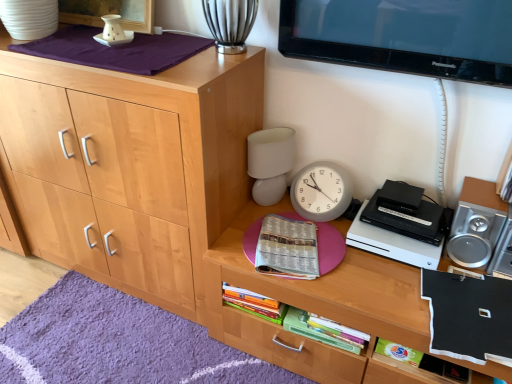
This screenshot has height=384, width=512. I want to click on free spot to the right of printed paper book at center, the third book from the right, so click(364, 272).